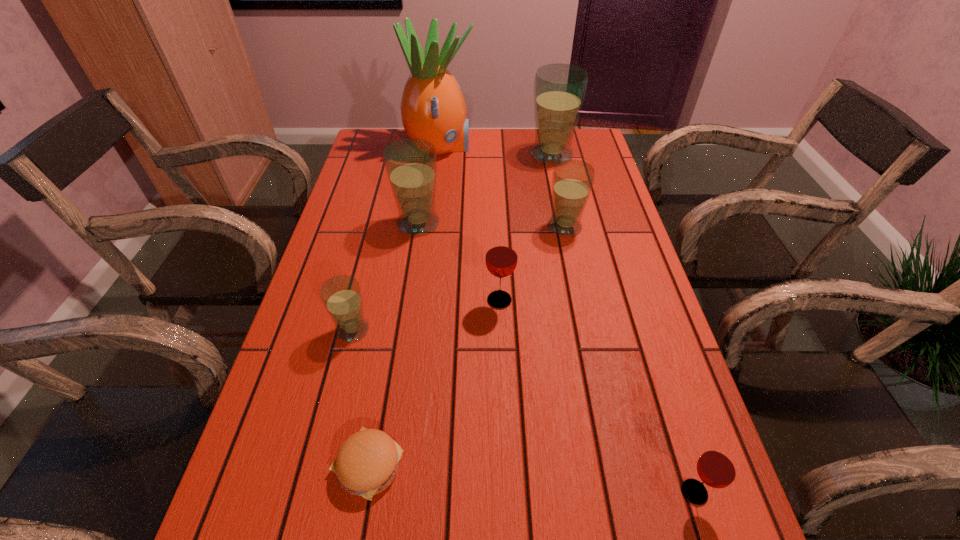
Locate an element on the screen. The image size is (960, 540). vacant space located 0.070m on the left of the rightmost object is located at coordinates (636, 492).

At what (x,y) coordinates should I click in order to perform the action: click on vacant space located on the right of the shortest object. Please return your answer as a coordinate pair (x, y). The height and width of the screenshot is (540, 960). Looking at the image, I should click on (473, 465).

Where is `pineapple situated at the far edge`? The height and width of the screenshot is (540, 960). pineapple situated at the far edge is located at coordinates (432, 107).

You are a GUI agent. You are given a task and a screenshot of the screen. Output one action in this format:
    pyautogui.click(x=<x>, y=<y>)
    Task: Click on the glass that is at the far edge
    Image resolution: width=960 pixels, height=540 pixels.
    Given the screenshot: What is the action you would take?
    pyautogui.click(x=559, y=89)

Where is `pineapple at the left edge`? The height and width of the screenshot is (540, 960). pineapple at the left edge is located at coordinates (432, 107).

Find the location of a particular element. glass located at the left edge is located at coordinates (341, 295).

Locate an element on the screen. This screenshot has height=540, width=960. patty at the left edge is located at coordinates (367, 462).

In order to click on object that is at the far left corner in this screenshot , I will do `click(432, 107)`.

What are the coordinates of `object that is at the far right corner` in the screenshot? It's located at tap(559, 89).

In the image, there is a desktop. At what (x,y) coordinates should I click in order to perform the action: click on vacant space at the left edge. Please return your answer as a coordinate pair (x, y). This screenshot has width=960, height=540. Looking at the image, I should click on (297, 326).